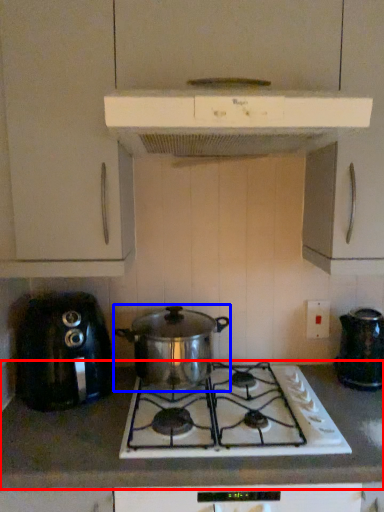
Question: Which point is closer to the camera, countertop (highlighted by a red box) or kitchen appliance (highlighted by a blue box)?

Choices:
 (A) countertop
 (B) kitchen appliance

Answer: (A)